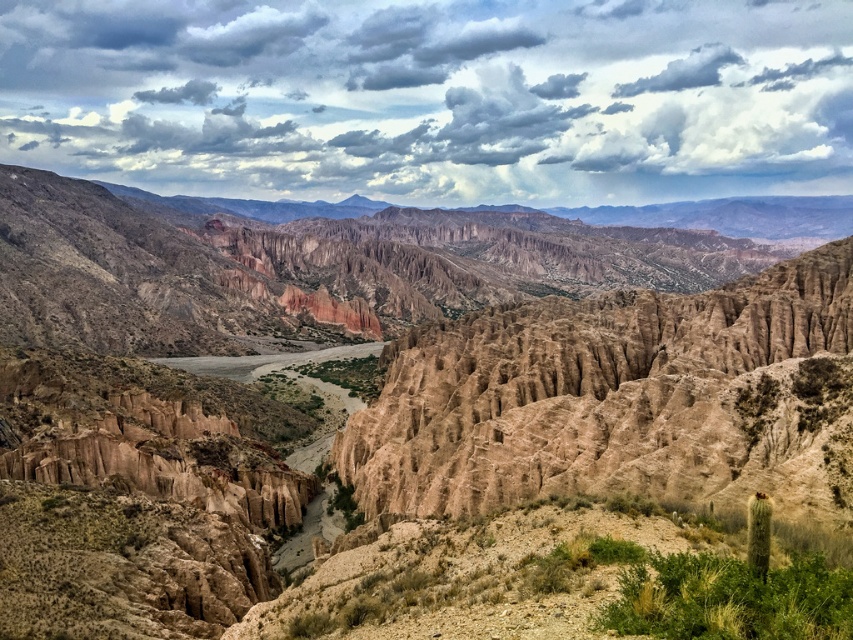
You are standing at the edge of the brown sandy river at center and want to look up to the cloudy sky at upper center. In which direction should you turn your head?

You should turn your head to the right to look up at the cloudy sky at upper center since it is located to the right of the brown sandy river at center.

You are a hiker planning to cross from the brown rocky terrain at center to the brown sandy river at center. Given that your backpack can only carry enough water for a 100 meter journey, will you be able to make the crossing without needing additional water?

The distance between the brown rocky terrain at center and the brown sandy river at center is 106.07 meters. Since your backpack can only carry enough water for 100 meters, you will need additional water to complete the crossing.